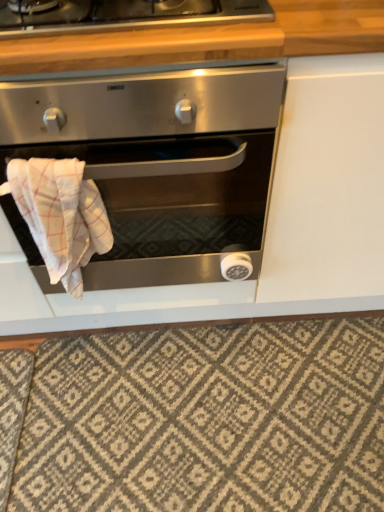
Question: Considering the relative positions of satin silver oven at center and patterned carpet at lower center in the image provided, is satin silver oven at center to the left or to the right of patterned carpet at lower center?

Choices:
 (A) left
 (B) right

Answer: (A)

Question: Is satin silver oven at center taller or shorter than patterned carpet at lower center?

Choices:
 (A) short
 (B) tall

Answer: (B)

Question: Based on their relative distances, which object is nearer to the wooden at upper center?

Choices:
 (A) white checkered cloth at lower left
 (B) satin silver oven at center
 (C) patterned carpet at lower center

Answer: (B)

Question: Considering the real-world distances, which object is closest to the patterned carpet at lower center?

Choices:
 (A) wooden at upper center
 (B) white checkered cloth at lower left
 (C) satin silver oven at center

Answer: (C)